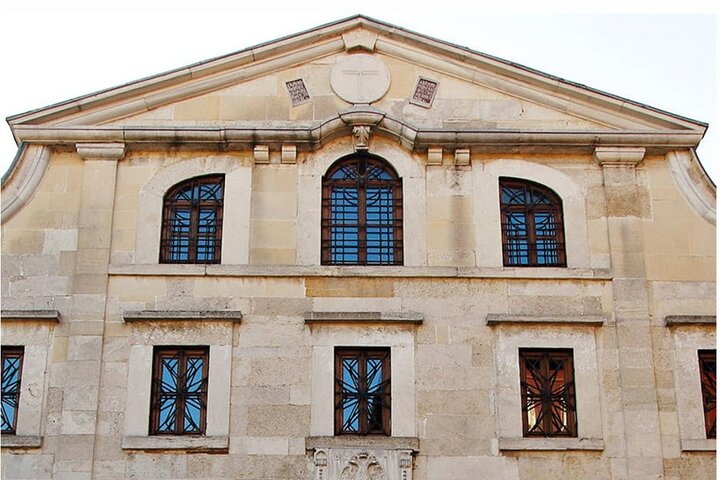
What are the coordinates of `curved window` in the screenshot? It's located at (363, 138).